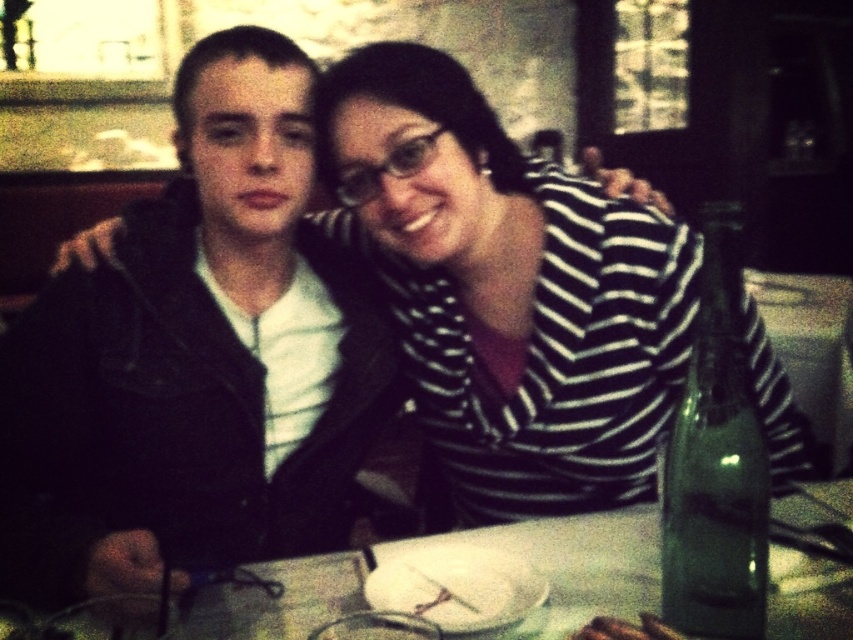
You are a server in a restaurant. You need to place a new menu between the green glass bottle at right and the brown crumbly bread at table center so that it doesn t fall off the table. Where should you place the menu?

Place the menu between the green glass bottle at right and the brown crumbly bread at table center. Since the green glass bottle at right is much taller than the brown crumbly bread at table center, the menu should be placed closer to the shorter brown crumbly bread at table center to prevent it from tipping over.

You are a photographer trying to capture a portrait of both the denim jacket at left and the striped fabric shirt at center. Since the lighting is dim, you need to adjust your camera to focus on the object that is closer to the front. Which object should you focus on?

The denim jacket at left is positioned under the striped fabric shirt at center, meaning it is closer to the front. Therefore, you should focus on the denim jacket at left to ensure it is in sharp focus.

You are a waiter in a restaurant. You need to place a new menu between the green glass bottle at right and the brown crumbly bread at table center. Can you fit it there?

The green glass bottle at right is positioned over the brown crumbly bread at table center, so there is no space between them to place the menu.